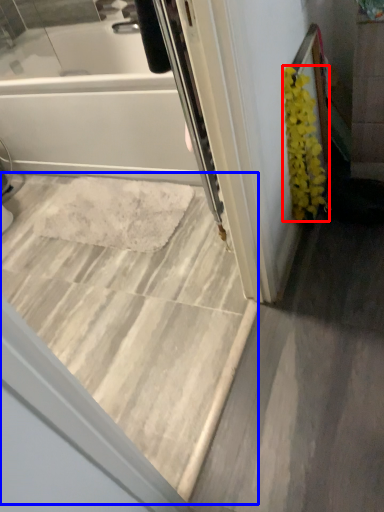
Question: Which object appears farthest to the camera in this image, flower (highlighted by a red box) or stairwell (highlighted by a blue box)?

Choices:
 (A) flower
 (B) stairwell

Answer: (A)